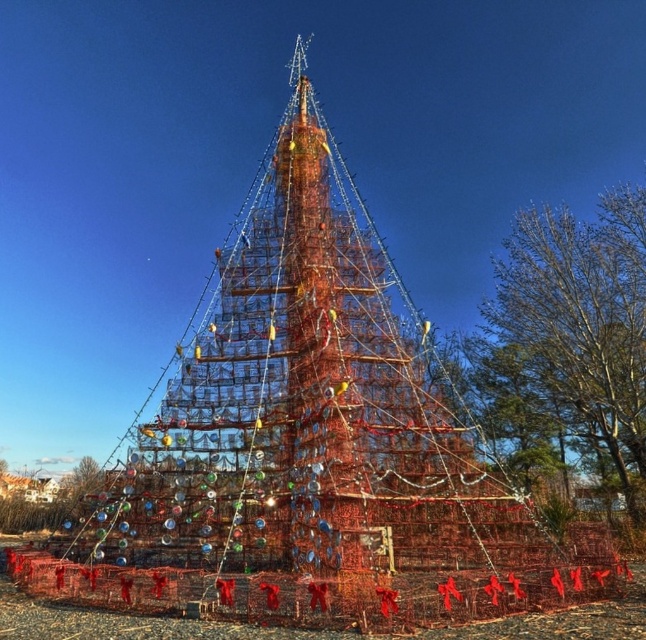
Does metallic wireframe structure at center appear on the left side of green leafy tree at right?

Yes, metallic wireframe structure at center is to the left of green leafy tree at right.

Is metallic wireframe structure at center positioned at the back of green leafy tree at right?

That is False.

Identify the location of metallic wireframe structure at center. This screenshot has height=640, width=646. (306, 428).